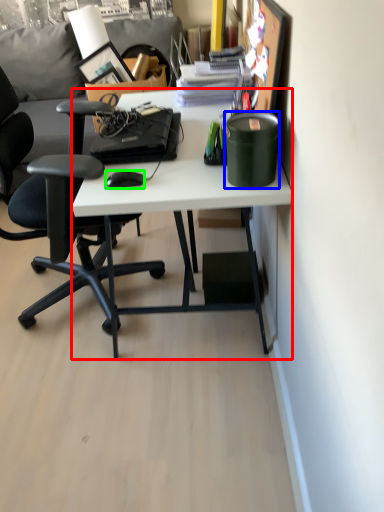
Question: Considering the real-world distances, which object is farthest from desk (highlighted by a red box)? stationery (highlighted by a blue box) or mouse (highlighted by a green box)?

Choices:
 (A) stationery
 (B) mouse

Answer: (B)